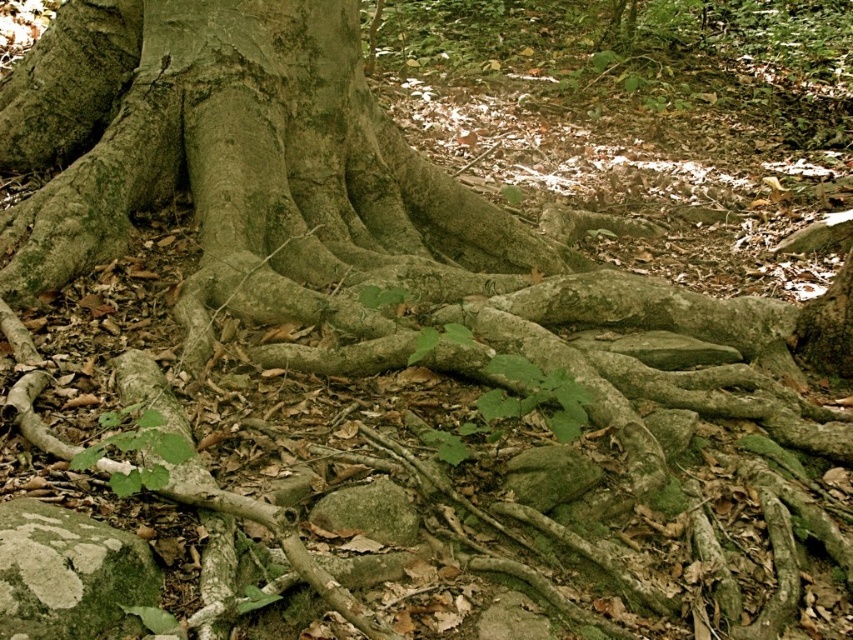
Question: Can you confirm if green mossy rock at lower left is wider than green mossy rock at center?

Choices:
 (A) no
 (B) yes

Answer: (B)

Question: Which object is farther from the camera taking this photo?

Choices:
 (A) green mossy rock at lower left
 (B) green mossy rock at center

Answer: (B)

Question: Which point is closer to the camera taking this photo?

Choices:
 (A) (61, 508)
 (B) (384, 484)

Answer: (A)

Question: Is green mossy rock at lower left thinner than green mossy rock at center?

Choices:
 (A) no
 (B) yes

Answer: (A)

Question: Does green mossy rock at lower left have a larger size compared to green mossy rock at center?

Choices:
 (A) no
 (B) yes

Answer: (B)